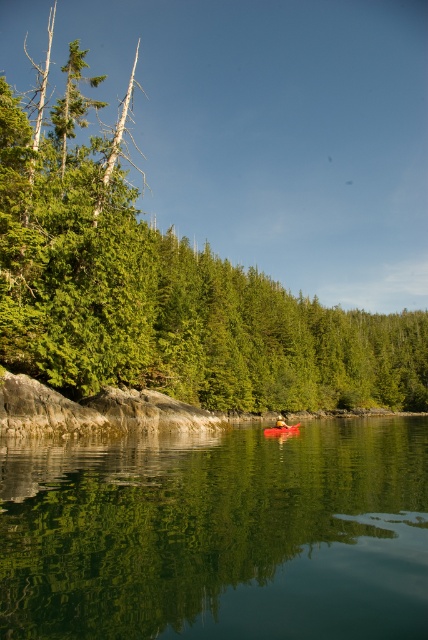
Question: Which is farther from the yellow fabric person at center?

Choices:
 (A) green leafy tree at center
 (B) matte red canoe at center
 (C) green smooth water at lower center

Answer: (A)

Question: Does green leafy tree at center have a greater width compared to matte red canoe at center?

Choices:
 (A) yes
 (B) no

Answer: (A)

Question: Is green leafy tree at center below green smooth water at lower center?

Choices:
 (A) no
 (B) yes

Answer: (A)

Question: Is green smooth water at lower center thinner than yellow fabric person at center?

Choices:
 (A) no
 (B) yes

Answer: (A)

Question: Which object is positioned closest to the yellow fabric person at center?

Choices:
 (A) green leafy tree at center
 (B) matte red canoe at center

Answer: (B)

Question: Which object appears closest to the camera in this image?

Choices:
 (A) green smooth water at lower center
 (B) yellow fabric person at center
 (C) green leafy tree at center

Answer: (A)